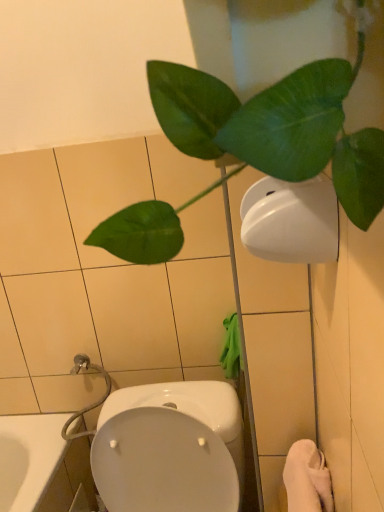
Describe the element at coordinates (307, 479) in the screenshot. I see `white soft towel at lower right` at that location.

The height and width of the screenshot is (512, 384). What do you see at coordinates (254, 145) in the screenshot?
I see `green matte leafy plant at upper right` at bounding box center [254, 145].

Locate an element on the screen. This screenshot has height=512, width=384. green matte leafy plant at upper right is located at coordinates (254, 145).

Image resolution: width=384 pixels, height=512 pixels. Describe the element at coordinates (170, 448) in the screenshot. I see `white glossy toilet at lower center` at that location.

Locate an element on the screen. white soft towel at lower right is located at coordinates (307, 479).

Considering the points (313, 224) and (314, 106), which point is behind, point (313, 224) or point (314, 106)?

The point (313, 224) is farther.

In terms of width, does white matte toilet paper at upper right look wider or thinner when compared to green matte leafy plant at upper right?

In the image, white matte toilet paper at upper right appears to be more narrow than green matte leafy plant at upper right.

Is white matte toilet paper at upper right facing away from green matte leafy plant at upper right?

white matte toilet paper at upper right is not turned away from green matte leafy plant at upper right.

How far apart are white matte toilet paper at upper right and green matte leafy plant at upper right?

white matte toilet paper at upper right and green matte leafy plant at upper right are 10.74 inches apart.

Is point (310, 117) farther from viewer compared to point (311, 457)?

No, (310, 117) is closer to viewer.

Is green matte leafy plant at upper right aimed at white soft towel at lower right?

No, green matte leafy plant at upper right is not facing towards white soft towel at lower right.

From the image's perspective, is green matte leafy plant at upper right located above or below white soft towel at lower right?

green matte leafy plant at upper right is above white soft towel at lower right.

Is green matte leafy plant at upper right inside or outside of white soft towel at lower right?

green matte leafy plant at upper right is spatially situated outside white soft towel at lower right.

In the scene shown: Visually, is green matte leafy plant at upper right positioned to the left or to the right of white glossy toilet at lower center?

green matte leafy plant at upper right is positioned on white glossy toilet at lower center's right side.

Where is `houseplant above the white glossy toilet at lower center (from the image's perspective)`? houseplant above the white glossy toilet at lower center (from the image's perspective) is located at coordinates (254, 145).

From the image's perspective, which object appears higher, green matte leafy plant at upper right or white glossy toilet at lower center?

green matte leafy plant at upper right appears higher in the image.

Is green matte leafy plant at upper right oriented away from white glossy toilet at lower center?

No, green matte leafy plant at upper right is not facing the opposite direction of white glossy toilet at lower center.

Which object is further away from the camera taking this photo, white matte toilet paper at upper right or white soft towel at lower right?

white soft towel at lower right is more distant.

This screenshot has height=512, width=384. I want to click on toilet paper that is on the left side of white soft towel at lower right, so click(291, 220).

From the image's perspective, is white matte toilet paper at upper right below white soft towel at lower right?

No.

Can you confirm if white matte toilet paper at upper right is bigger than white soft towel at lower right?

No, white matte toilet paper at upper right is not bigger than white soft towel at lower right.

At what (x,y) coordinates should I click in order to perform the action: click on bath towel beneath the green matte leafy plant at upper right (from a real-world perspective). Please return your answer as a coordinate pair (x, y). The height and width of the screenshot is (512, 384). Looking at the image, I should click on (307, 479).

Are white soft towel at lower right and green matte leafy plant at upper right making contact?

There is a gap between white soft towel at lower right and green matte leafy plant at upper right.

Considering the relative sizes of white soft towel at lower right and green matte leafy plant at upper right in the image provided, is white soft towel at lower right smaller than green matte leafy plant at upper right?

Correct, white soft towel at lower right occupies less space than green matte leafy plant at upper right.

Is white soft towel at lower right facing towards green matte leafy plant at upper right?

No, white soft towel at lower right is not aimed at green matte leafy plant at upper right.

Can you confirm if white glossy toilet at lower center is shorter than white soft towel at lower right?

No, white glossy toilet at lower center is not shorter than white soft towel at lower right.

Considering the points (160, 420) and (303, 496), which point is in front, point (160, 420) or point (303, 496)?

The point (303, 496) is closer.

Where is `bath towel that appears on the right of white glossy toilet at lower center`? bath towel that appears on the right of white glossy toilet at lower center is located at coordinates (307, 479).

Does white soft towel at lower right have a larger size compared to white glossy toilet at lower center?

Incorrect, white soft towel at lower right is not larger than white glossy toilet at lower center.

Who is taller, white soft towel at lower right or white glossy toilet at lower center?

white glossy toilet at lower center is taller.

Would you say white glossy toilet at lower center is part of white soft towel at lower right's contents?

Definitely not — white glossy toilet at lower center is not inside white soft towel at lower right.

Identify the location of toilet paper below the green matte leafy plant at upper right (from a real-world perspective). The image size is (384, 512). (291, 220).

Where is `houseplant above the white soft towel at lower right (from the image's perspective)`? The width and height of the screenshot is (384, 512). houseplant above the white soft towel at lower right (from the image's perspective) is located at coordinates (254, 145).

When comparing their distances from white matte toilet paper at upper right, does green matte leafy plant at upper right or white glossy toilet at lower center seem closer?

green matte leafy plant at upper right lies closer to white matte toilet paper at upper right than the other object.

Considering their positions, is white glossy toilet at lower center positioned closer to white matte toilet paper at upper right than green matte leafy plant at upper right?

The object closer to white matte toilet paper at upper right is green matte leafy plant at upper right.

Estimate the real-world distances between objects in this image. Which object is further from white glossy toilet at lower center, white soft towel at lower right or white matte toilet paper at upper right?

white matte toilet paper at upper right is positioned further to the anchor white glossy toilet at lower center.

Based on the photo, estimate the real-world distances between objects in this image. Which object is closer to white matte toilet paper at upper right, white glossy toilet at lower center or white soft towel at lower right?

Based on the image, white soft towel at lower right appears to be nearer to white matte toilet paper at upper right.

Which object lies nearer to the anchor point white glossy toilet at lower center, white matte toilet paper at upper right or white soft towel at lower right?

white soft towel at lower right is closer to white glossy toilet at lower center.

Looking at the image, which one is located closer to green matte leafy plant at upper right, white soft towel at lower right or white matte toilet paper at upper right?

white matte toilet paper at upper right is positioned closer to the anchor green matte leafy plant at upper right.

From the image, which object appears to be farther from green matte leafy plant at upper right, white matte toilet paper at upper right or white glossy toilet at lower center?

white glossy toilet at lower center is further to green matte leafy plant at upper right.

From the image, which object appears to be farther from white soft towel at lower right, white matte toilet paper at upper right or white glossy toilet at lower center?

Among the two, white matte toilet paper at upper right is located further to white soft towel at lower right.

At what (x,y) coordinates should I click in order to perform the action: click on toilet paper between green matte leafy plant at upper right and white soft towel at lower right in the vertical direction. Please return your answer as a coordinate pair (x, y). This screenshot has width=384, height=512. Looking at the image, I should click on (291, 220).

Where is `toilet paper between green matte leafy plant at upper right and white glossy toilet at lower center in the up-down direction`? Image resolution: width=384 pixels, height=512 pixels. toilet paper between green matte leafy plant at upper right and white glossy toilet at lower center in the up-down direction is located at coordinates (291, 220).

This screenshot has height=512, width=384. I want to click on bath towel between white matte toilet paper at upper right and white glossy toilet at lower center in the up-down direction, so point(307,479).

The image size is (384, 512). In order to click on bath towel that lies between green matte leafy plant at upper right and white glossy toilet at lower center from top to bottom in this screenshot , I will do `click(307, 479)`.